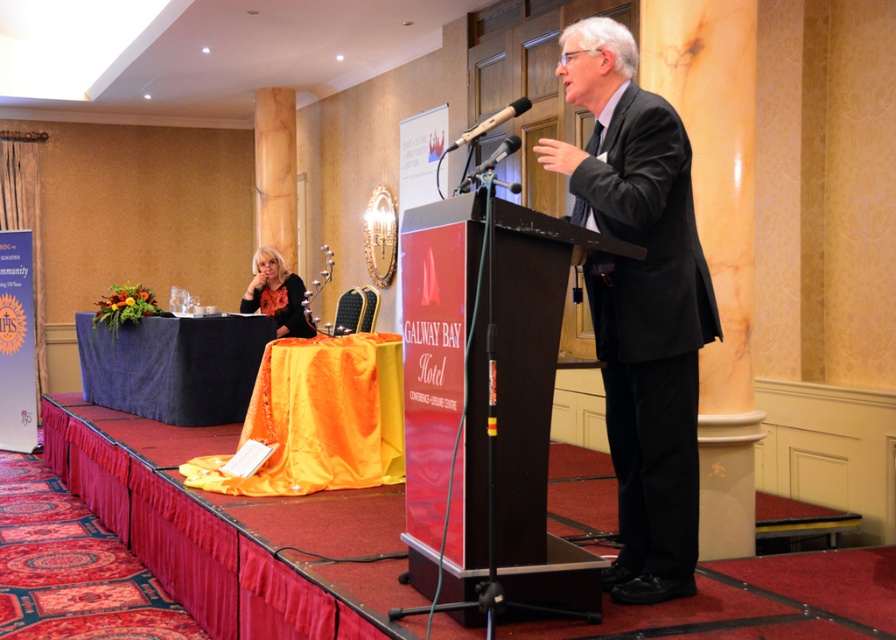
Does matte black podium at center appear on the left side of matte orange dress at lower left?

In fact, matte black podium at center is to the right of matte orange dress at lower left.

From the picture: Who is shorter, matte black podium at center or matte orange dress at lower left?

Standing shorter between the two is matte orange dress at lower left.

Does point (522, 456) come in front of point (291, 321)?

That is True.

Identify the location of matte black podium at center. (487, 400).

Between matte black podium at center and black plastic microphone at center, which one is positioned higher?

black plastic microphone at center

Does point (556, 317) lie behind point (487, 120)?

Yes, it is.

Who is more forward, [403,364] or [459,138]?

Point [459,138]

Locate an element on the screen. The height and width of the screenshot is (640, 896). matte black podium at center is located at coordinates (487, 400).

Which is behind, point (119, 346) or point (475, 132)?

The point (119, 346) is more distant.

Who is more forward, [182,396] or [519,115]?

Point [519,115]

Who is more forward, (191, 346) or (526, 104)?

Point (526, 104)

You are a GUI agent. You are given a task and a screenshot of the screen. Output one action in this format:
    pyautogui.click(x=<x>, y=<y>)
    Task: Click on the velvet blue tablecloth at left
    
    Given the screenshot: What is the action you would take?
    pyautogui.click(x=173, y=365)